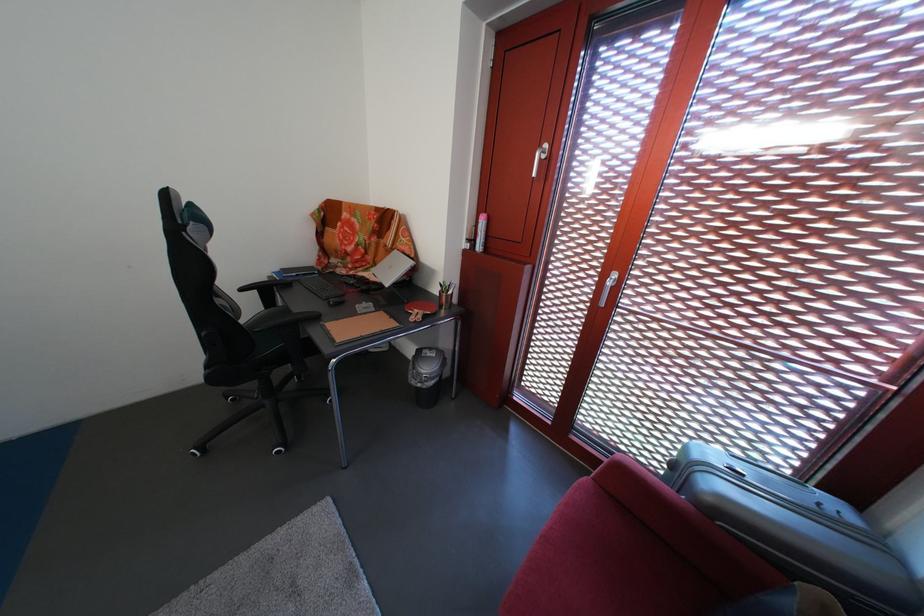
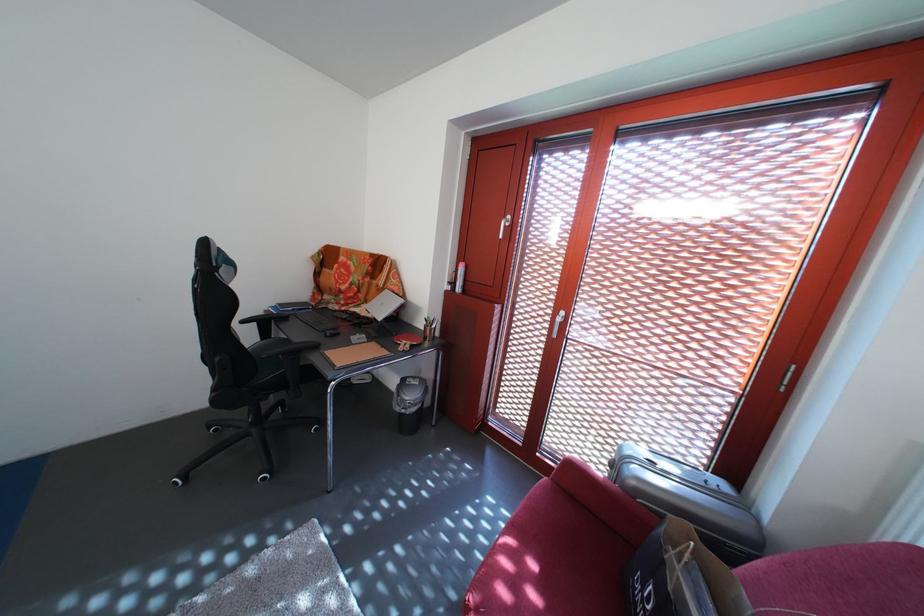
Where in the second image is the point corresponding to [684,472] from the first image?

(623, 471)